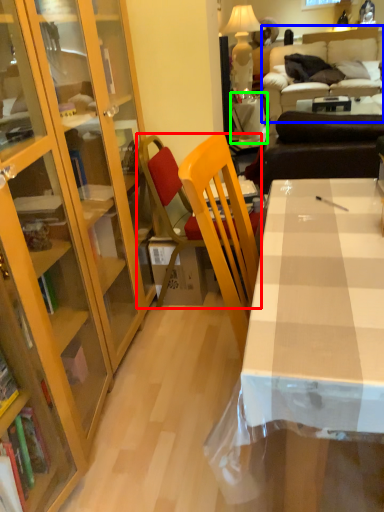
Question: Considering the real-world distances, which object is closest to chair (highlighted by a red box)? studio couch (highlighted by a blue box) or table (highlighted by a green box).

Choices:
 (A) studio couch
 (B) table

Answer: (B)